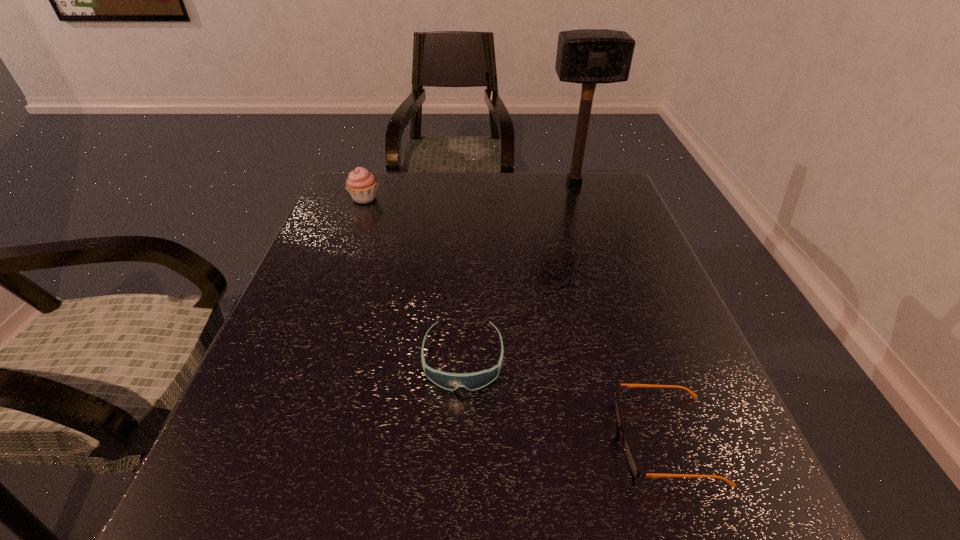
The width and height of the screenshot is (960, 540). I want to click on vacant region located 0.190m on the front-facing side of the shortest object, so click(498, 439).

Locate an element on the screen. free space located on the front-facing side of the shortest object is located at coordinates (579, 439).

The height and width of the screenshot is (540, 960). What are the coordinates of `vacant space located on the front-facing side of the shortest object` in the screenshot? It's located at (511, 439).

Identify the location of mallet that is at the far edge. (589, 56).

Find the location of a particular element. This screenshot has width=960, height=540. cupcake positioned at the far edge is located at coordinates (361, 184).

The height and width of the screenshot is (540, 960). In order to click on object present at the near edge in this screenshot , I will do `click(634, 467)`.

Identify the location of object present at the left edge. (361, 184).

Locate an element on the screen. Image resolution: width=960 pixels, height=540 pixels. mallet that is at the right edge is located at coordinates click(x=589, y=56).

Find the location of a particular element. The width and height of the screenshot is (960, 540). spectacles present at the right edge is located at coordinates (634, 467).

The image size is (960, 540). What are the coordinates of `object that is positioned at the far left corner` in the screenshot? It's located at (361, 184).